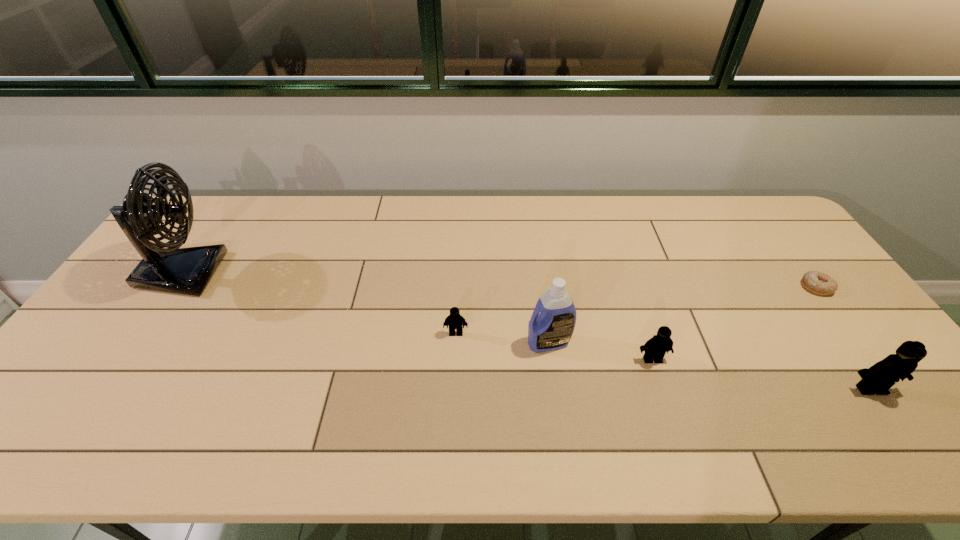
Please point a vacant point for placing a Lego on the left. Please provide its 2D coordinates. Your answer should be formatted as a tuple, i.e. [(x, y)], where the tuple contains the x and y coordinates of a point satisfying the conditions above.

[(278, 309)]